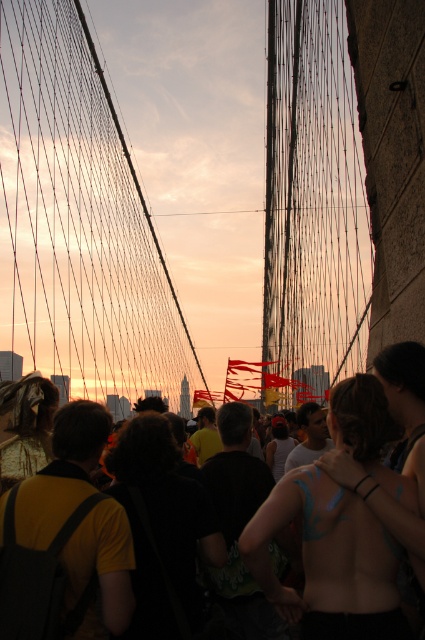
Question: Is body paint at center in front of yellow matte shirt at lower left?

Choices:
 (A) yes
 (B) no

Answer: (A)

Question: Does black wire suspension bridge at center come in front of body paint at center?

Choices:
 (A) yes
 (B) no

Answer: (B)

Question: Is black wire suspension bridge at center thinner than dark yellow shirt at center?

Choices:
 (A) no
 (B) yes

Answer: (A)

Question: Considering the real-world distances, which object is farthest from the yellow matte shirt at lower left?

Choices:
 (A) black wire suspension bridge at center
 (B) body paint at center
 (C) dark yellow shirt at center

Answer: (A)

Question: Which object is positioned closest to the body paint at center?

Choices:
 (A) black wire suspension bridge at center
 (B) dark yellow shirt at center

Answer: (B)

Question: Which of the following is the farthest from the observer?

Choices:
 (A) dark yellow shirt at center
 (B) yellow matte shirt at lower left
 (C) body paint at center

Answer: (A)